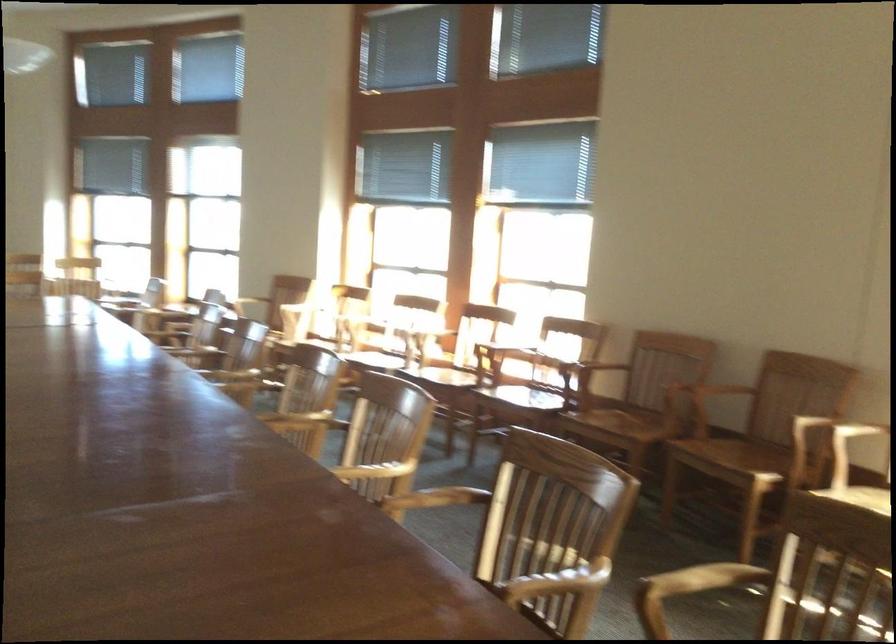
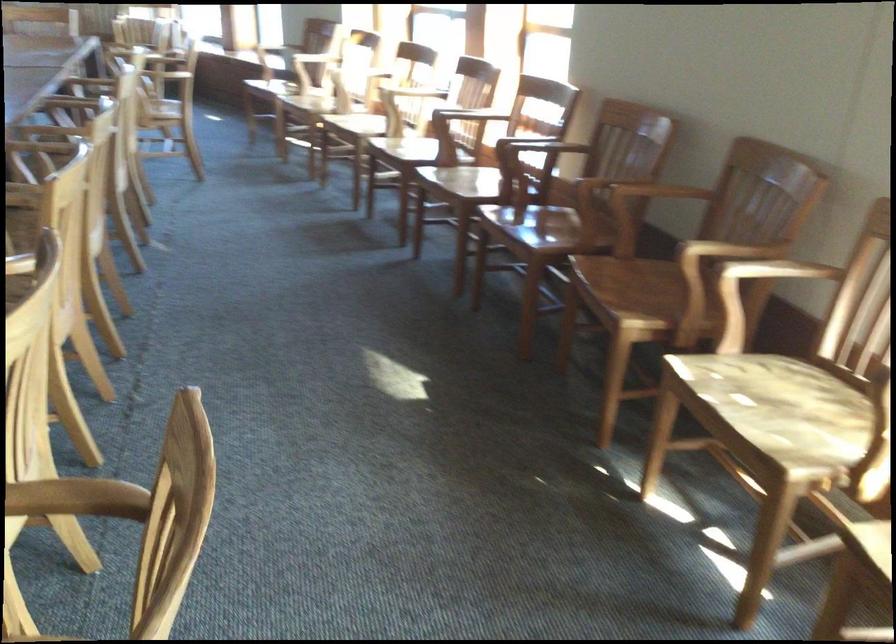
Locate, in the second image, the point that corresponds to pixel 707 573 in the first image.

(76, 498)